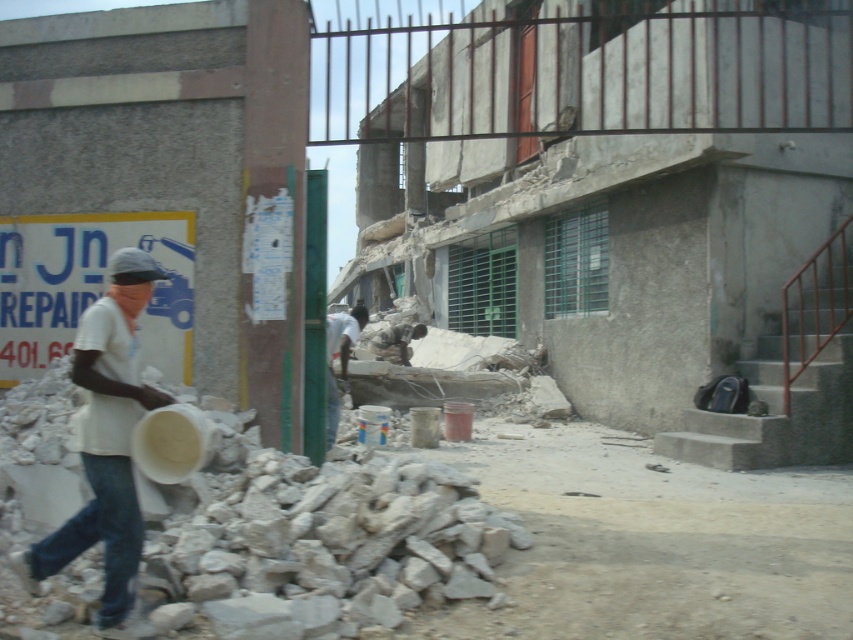
You are a construction worker observing the scene. You need to determine which item is nearer to you between the jeans at left and the white fabric shirt at center. Which one is closer?

The jeans at left is closer to the viewer than the white fabric shirt at center.

You are a construction worker who needs to retrieve your white matte bucket at left and white fabric shirt at center. Which item is easier to reach without moving from your current position?

The white matte bucket at left is closer to the viewer than the white fabric shirt at center, so it is easier to reach without moving.

You are a construction worker who needs to determine which object is bigger between the white matte bucket at left and the white fabric shirt at center. Based on the scene, which one is bigger?

The white matte bucket at left is larger in size than the white fabric shirt at center, so the bucket is bigger.